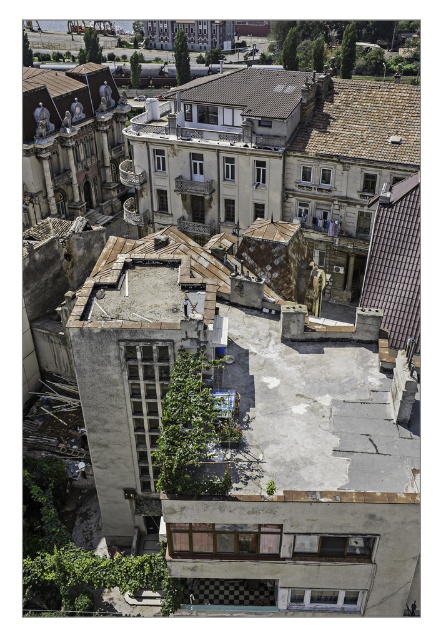
Question: Which point is farther from the camera taking this photo?

Choices:
 (A) (342, 100)
 (B) (26, 77)
 (C) (200, 120)

Answer: (B)

Question: Which point is closer to the camera?

Choices:
 (A) brown shingles at upper left
 (B) brown tile roof at upper right
 (C) brown tiled roof at upper right
 (D) brown tiled roof at upper center

Answer: (C)

Question: Can you confirm if brown tile roof at upper right is bigger than brown shingles at upper left?

Choices:
 (A) yes
 (B) no

Answer: (A)

Question: Is brown tiled roof at upper right to the left of brown tiled roof at upper center from the viewer's perspective?

Choices:
 (A) yes
 (B) no

Answer: (B)

Question: Which is nearer to the brown tile roof at upper right?

Choices:
 (A) brown shingles at upper left
 (B) brown tiled roof at upper right
 (C) brown tiled roof at upper center

Answer: (C)

Question: Is brown tiled roof at upper center closer to the viewer compared to brown shingles at upper left?

Choices:
 (A) yes
 (B) no

Answer: (A)